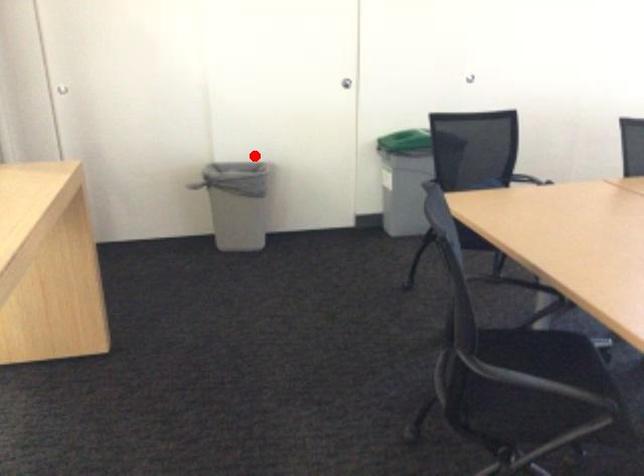
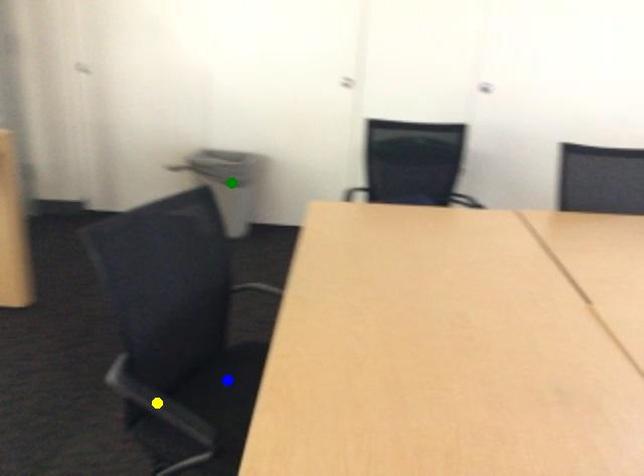
Question: I am providing you with two images of the same scene from different viewpoints. A red point is marked on the first image. You are given multiple points on the second image. Which point in image 2 is actually the same real-world point as the red point in image 1?

Choices:
 (A) yellow point
 (B) blue point
 (C) green point

Answer: (C)